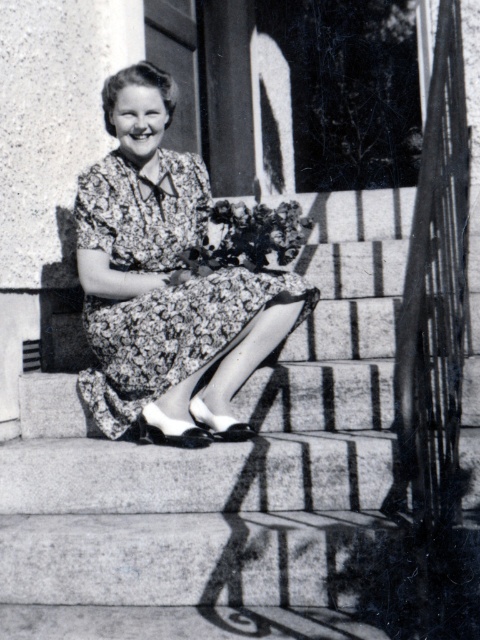
Who is positioned more to the right, smooth concrete stairs at center or floral dress at center?

From the viewer's perspective, smooth concrete stairs at center appears more on the right side.

Which is behind, point (232, 556) or point (115, 177)?

Point (115, 177)

Where is `smooth concrete stairs at center`? smooth concrete stairs at center is located at coordinates (237, 477).